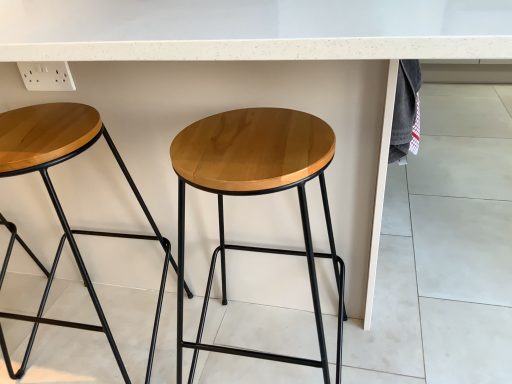
Question: Can you confirm if natural wood stool at center, which is the first stool from right to left, is thinner than wooden seat stool at center, marked as the second stool in a right-to-left arrangement?

Choices:
 (A) yes
 (B) no

Answer: (B)

Question: Considering the relative sizes of natural wood stool at center, which is the first stool from right to left, and wooden seat stool at center, the first stool from the left, in the image provided, is natural wood stool at center, which is the first stool from right to left, shorter than wooden seat stool at center, the first stool from the left,?

Choices:
 (A) no
 (B) yes

Answer: (A)

Question: Can wooden seat stool at center, the first stool from the left, be found inside natural wood stool at center, which ranks as the 2th stool in left-to-right order?

Choices:
 (A) yes
 (B) no

Answer: (B)

Question: Is wooden seat stool at center, the first stool from the left, at the back of natural wood stool at center, which is the first stool from right to left?

Choices:
 (A) no
 (B) yes

Answer: (A)

Question: From the image's perspective, is natural wood stool at center, which ranks as the 2th stool in left-to-right order, located above wooden seat stool at center, the first stool from the left?

Choices:
 (A) yes
 (B) no

Answer: (B)

Question: Does natural wood stool at center, which is the first stool from right to left, turn towards wooden seat stool at center, the first stool from the left?

Choices:
 (A) yes
 (B) no

Answer: (B)

Question: Would you consider wooden seat stool at center, the first stool from the left, to be distant from natural wood stool at center, which is the first stool from right to left?

Choices:
 (A) no
 (B) yes

Answer: (A)

Question: Can you confirm if wooden seat stool at center, the first stool from the left, is positioned to the right of natural wood stool at center, which ranks as the 2th stool in left-to-right order?

Choices:
 (A) yes
 (B) no

Answer: (B)

Question: Does wooden seat stool at center, marked as the second stool in a right-to-left arrangement, come in front of natural wood stool at center, which ranks as the 2th stool in left-to-right order?

Choices:
 (A) yes
 (B) no

Answer: (B)

Question: Considering the relative sizes of wooden seat stool at center, the first stool from the left, and natural wood stool at center, which is the first stool from right to left, in the image provided, is wooden seat stool at center, the first stool from the left, thinner than natural wood stool at center, which is the first stool from right to left,?

Choices:
 (A) yes
 (B) no

Answer: (A)

Question: Does wooden seat stool at center, the first stool from the left, contain natural wood stool at center, which is the first stool from right to left?

Choices:
 (A) no
 (B) yes

Answer: (A)

Question: Is wooden seat stool at center, marked as the second stool in a right-to-left arrangement, turned away from natural wood stool at center, which ranks as the 2th stool in left-to-right order?

Choices:
 (A) no
 (B) yes

Answer: (A)

Question: Visually, is natural wood stool at center, which ranks as the 2th stool in left-to-right order, positioned to the left or to the right of wooden seat stool at center, the first stool from the left?

Choices:
 (A) right
 (B) left

Answer: (A)